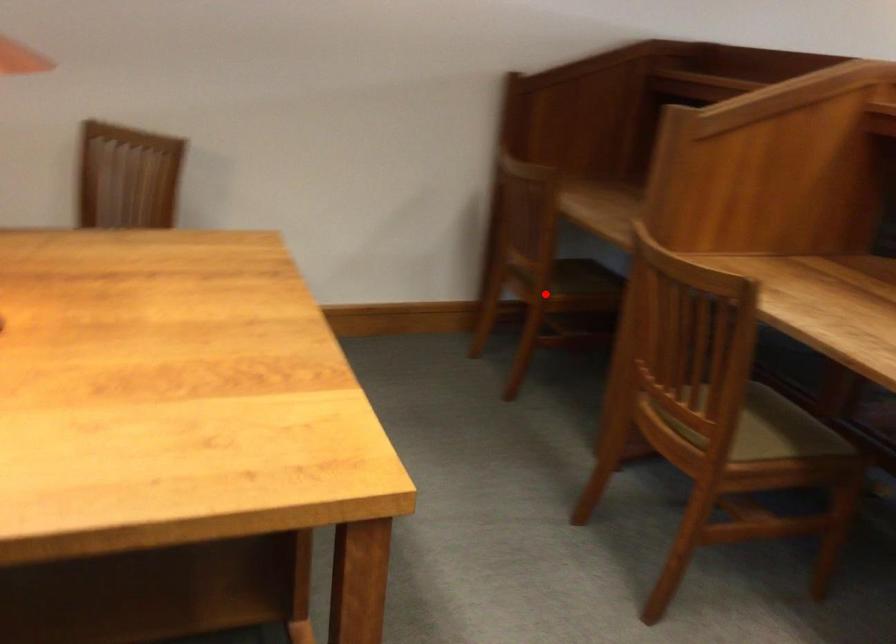
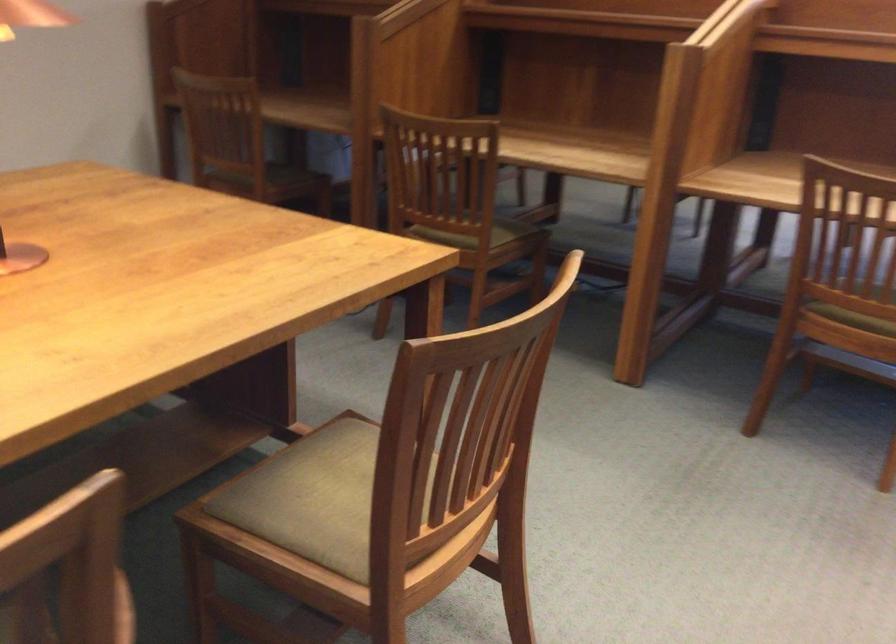
Question: I am providing you with two images of the same scene from different viewpoints. In image1, a red point is highlighted. Considering the same 3D point in image2, which of the following is correct?

Choices:
 (A) It is closer
 (B) It is farther

Answer: (B)